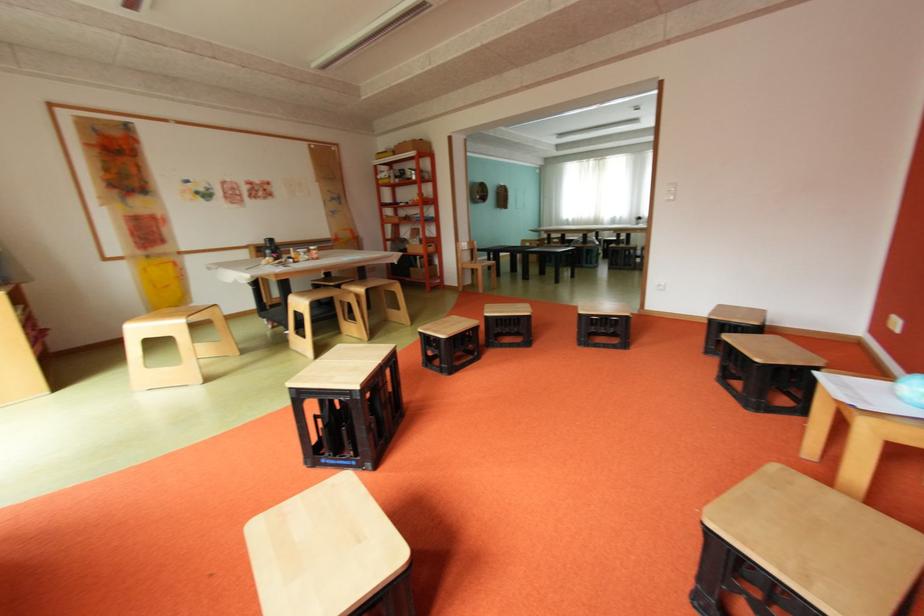
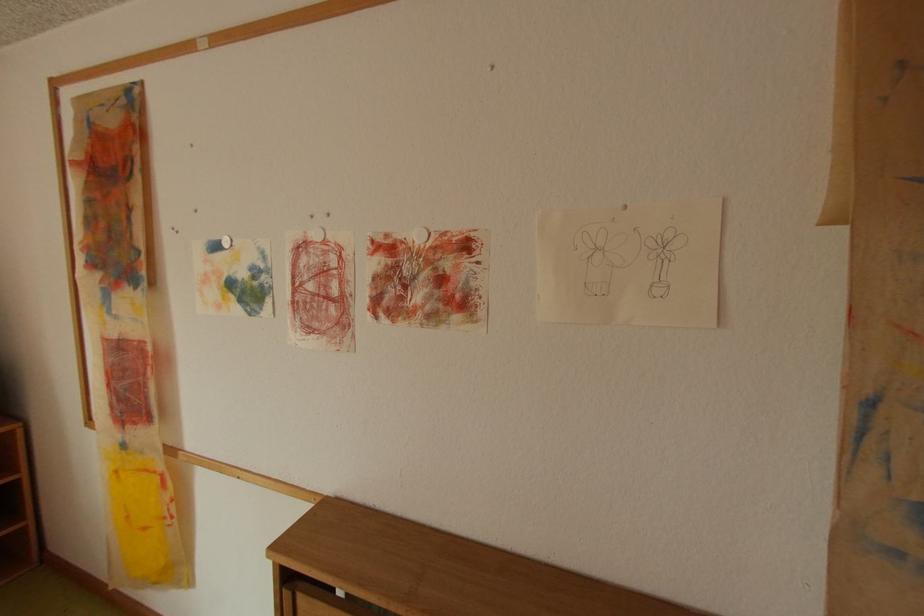
Locate, in the second image, the point that corresponds to [157,257] in the first image.

(134, 446)